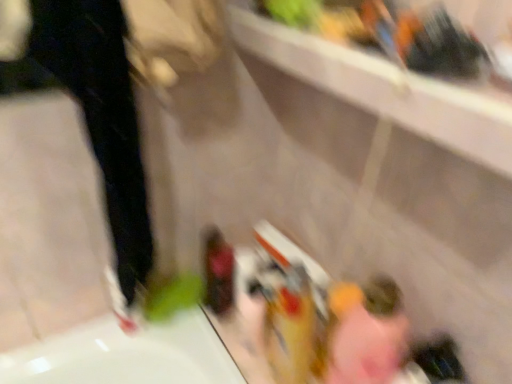
Question: Considering the relative sizes of pink fabric at lower right and black matte pants at left in the image provided, is pink fabric at lower right smaller than black matte pants at left?

Choices:
 (A) yes
 (B) no

Answer: (A)

Question: Is pink fabric at lower right bigger than black matte pants at left?

Choices:
 (A) no
 (B) yes

Answer: (A)

Question: Is black matte pants at left at the back of pink fabric at lower right?

Choices:
 (A) yes
 (B) no

Answer: (B)

Question: Is pink fabric at lower right not inside black matte pants at left?

Choices:
 (A) no
 (B) yes

Answer: (B)

Question: Does pink fabric at lower right have a greater width compared to black matte pants at left?

Choices:
 (A) yes
 (B) no

Answer: (A)

Question: From the image's perspective, relative to black matte pants at left, is pink fabric at lower right above or below?

Choices:
 (A) above
 (B) below

Answer: (B)

Question: Looking at the image, does pink fabric at lower right seem bigger or smaller compared to black matte pants at left?

Choices:
 (A) small
 (B) big

Answer: (A)

Question: Is point [x=342, y=380] positioned closer to the camera than point [x=81, y=59]?

Choices:
 (A) farther
 (B) closer

Answer: (A)

Question: In terms of width, does pink fabric at lower right look wider or thinner when compared to black matte pants at left?

Choices:
 (A) thin
 (B) wide

Answer: (B)

Question: Looking at the image, does white matte shoe at lower left seem bigger or smaller compared to black matte pants at left?

Choices:
 (A) big
 (B) small

Answer: (B)

Question: Is white matte shoe at lower left in front of or behind black matte pants at left in the image?

Choices:
 (A) behind
 (B) front

Answer: (A)

Question: Looking at their shapes, would you say white matte shoe at lower left is wider or thinner than black matte pants at left?

Choices:
 (A) wide
 (B) thin

Answer: (B)

Question: From a real-world perspective, is white matte shoe at lower left physically located above or below black matte pants at left?

Choices:
 (A) above
 (B) below

Answer: (B)

Question: Is black matte pants at left bigger or smaller than white matte shoe at lower left?

Choices:
 (A) small
 (B) big

Answer: (B)

Question: Is black matte pants at left taller or shorter than white matte shoe at lower left?

Choices:
 (A) tall
 (B) short

Answer: (A)